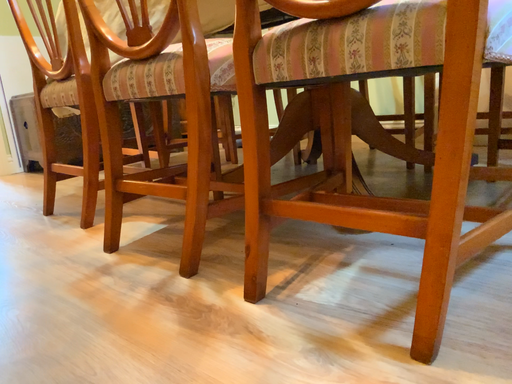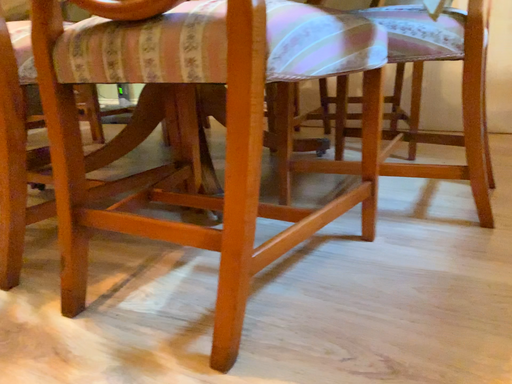
Question: How did the camera likely rotate when shooting the video?

Choices:
 (A) rotated right
 (B) rotated left

Answer: (A)